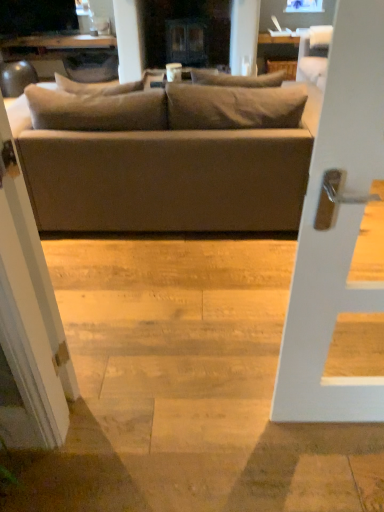
Where is `matte gray couch at center`? This screenshot has height=512, width=384. matte gray couch at center is located at coordinates (166, 176).

This screenshot has width=384, height=512. Find the location of `white glossy screen door at left`. white glossy screen door at left is located at coordinates (29, 318).

Considering the relative sizes of white glossy screen door at left and matte black tv at upper left in the image provided, is white glossy screen door at left thinner than matte black tv at upper left?

Yes.

Is point (7, 165) closer or farther from the camera than point (22, 23)?

Point (7, 165).

This screenshot has width=384, height=512. What are the coordinates of `dark behind the white glossy screen door at left` in the screenshot? It's located at (37, 16).

Does white glossy screen door at left contain matte gray couch at center?

No.

Considering the positions of point (31, 345) and point (222, 172), is point (31, 345) closer or farther from the camera than point (222, 172)?

Point (31, 345) is closer to the camera than point (222, 172).

Is white glossy screen door at left closer to the viewer compared to matte gray couch at center?

Yes, white glossy screen door at left is closer to the camera.

Does matte gray couch at center turn towards matte black tv at upper left?

No, matte gray couch at center is not facing towards matte black tv at upper left.

Is matte gray couch at center at the left side of matte black tv at upper left?

Incorrect, matte gray couch at center is not on the left side of matte black tv at upper left.

Does matte gray couch at center have a larger size compared to matte black tv at upper left?

Yes.

Is matte gray couch at center next to matte black tv at upper left?

No, matte gray couch at center is not making contact with matte black tv at upper left.

Is white glossy screen door at left positioned far away from white matte door handle at center?

They are positioned close to each other.

At what (x,y) coordinates should I click in order to perform the action: click on screen door behind the white matte door handle at center. Please return your answer as a coordinate pair (x, y). The width and height of the screenshot is (384, 512). Looking at the image, I should click on (29, 318).

From a real-world perspective, which is physically below, white glossy screen door at left or white matte door handle at center?

In real-world perspective, white glossy screen door at left is lower.

From the image's perspective, which object appears higher, white glossy screen door at left or white matte door handle at center?

white glossy screen door at left, from the image's perspective.

Who is more distant, matte black tv at upper left or matte gray couch at center?

matte black tv at upper left is further away from the camera.

Considering the sizes of objects matte black tv at upper left and matte gray couch at center in the image provided, who is shorter, matte black tv at upper left or matte gray couch at center?

matte black tv at upper left is shorter.

How many degrees apart are the facing directions of matte black tv at upper left and matte gray couch at center?

The facing directions of matte black tv at upper left and matte gray couch at center are 114 degrees apart.

Is matte black tv at upper left to the left or to the right of white glossy screen door at left in the image?

Based on their positions, matte black tv at upper left is located to the left of white glossy screen door at left.

Find the location of a particular element. dark lying on the left of white glossy screen door at left is located at coordinates (37, 16).

Is white glossy screen door at left at the back of matte black tv at upper left?

No, matte black tv at upper left is not facing the opposite direction of white glossy screen door at left.

Considering the sizes of objects matte black tv at upper left and white glossy screen door at left in the image provided, who is thinner, matte black tv at upper left or white glossy screen door at left?

With smaller width is white glossy screen door at left.

Which object is further away from the camera, white matte door handle at center or white glossy screen door at left?

→ white glossy screen door at left is more distant.

Is white matte door handle at center situated inside white glossy screen door at left or outside?

white matte door handle at center is spatially situated outside white glossy screen door at left.

From the image's perspective, is white matte door handle at center located above white glossy screen door at left?

Actually, white matte door handle at center appears below white glossy screen door at left in the image.

From a real-world perspective, is white matte door handle at center on top of white glossy screen door at left?

Correct, in the physical world, white matte door handle at center is higher than white glossy screen door at left.

In the image, there is a matte black tv at upper left. Identify the location of screen door below it (from a real-world perspective). Image resolution: width=384 pixels, height=512 pixels. (29, 318).

Find the location of `screen door in front of the matte gray couch at center`. screen door in front of the matte gray couch at center is located at coordinates (29, 318).

Looking at the image, which one is located closer to matte black tv at upper left, white glossy screen door at left or matte gray couch at center?

matte gray couch at center is closer to matte black tv at upper left.

Looking at the image, which one is located further to matte black tv at upper left, white glossy screen door at left or white matte door handle at center?

white matte door handle at center is positioned further to the anchor matte black tv at upper left.

Looking at the image, which one is located closer to matte gray couch at center, white glossy screen door at left or white matte door handle at center?

white glossy screen door at left is positioned closer to the anchor matte gray couch at center.

From the image, which object appears to be farther from matte black tv at upper left, matte gray couch at center or white matte door handle at center?

The object further to matte black tv at upper left is white matte door handle at center.

Which object lies nearer to the anchor point white glossy screen door at left, white matte door handle at center or matte black tv at upper left?

The object closer to white glossy screen door at left is white matte door handle at center.

Looking at this image, which object lies further to the anchor point white glossy screen door at left, matte gray couch at center or matte black tv at upper left?

matte black tv at upper left lies further to white glossy screen door at left than the other object.

Based on their spatial positions, is matte black tv at upper left or white matte door handle at center closer to white glossy screen door at left?

white matte door handle at center is closer to white glossy screen door at left.

When comparing their distances from matte gray couch at center, does white matte door handle at center or white glossy screen door at left seem closer?

white glossy screen door at left is closer to matte gray couch at center.

This screenshot has width=384, height=512. Find the location of `studio couch between white glossy screen door at left and matte black tv at upper left from front to back`. studio couch between white glossy screen door at left and matte black tv at upper left from front to back is located at coordinates pos(166,176).

You are a GUI agent. You are given a task and a screenshot of the screen. Output one action in this format:
    pyautogui.click(x=<x>, y=<y>)
    Task: Click on the screen door between white matte door handle at center and matte black tv at upper left along the z-axis
    
    Given the screenshot: What is the action you would take?
    pyautogui.click(x=29, y=318)

You are a GUI agent. You are given a task and a screenshot of the screen. Output one action in this format:
    pyautogui.click(x=<x>, y=<y>)
    Task: Click on the screen door located between white matte door handle at center and matte gray couch at center in the depth direction
    This screenshot has width=384, height=512.
    Given the screenshot: What is the action you would take?
    pyautogui.click(x=29, y=318)

At what (x,y) coordinates should I click in order to perform the action: click on studio couch between white matte door handle at center and matte black tv at upper left from front to back. Please return your answer as a coordinate pair (x, y). This screenshot has height=512, width=384. Looking at the image, I should click on (166, 176).